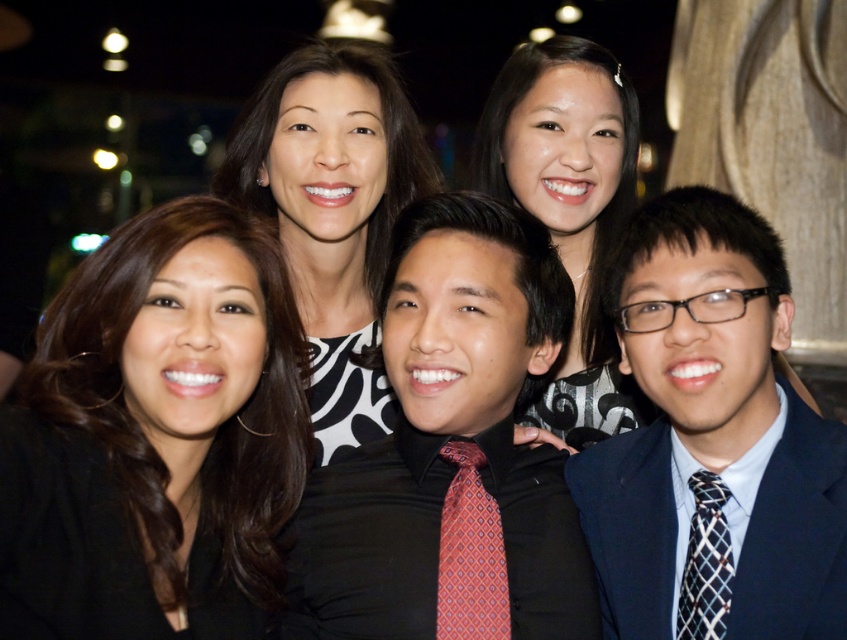
Question: Which object is the closest to the navy blue suit at center?

Choices:
 (A) black matte hair at left
 (B) red silk tie at center

Answer: (B)

Question: Which of these objects is positioned closest to the black checkered tie at right?

Choices:
 (A) matte black dress at center
 (B) red silk tie at center
 (C) black satin shirt at center
 (D) matte black dress at upper center

Answer: (B)

Question: Does navy blue suit at center have a larger size compared to matte black dress at upper center?

Choices:
 (A) yes
 (B) no

Answer: (A)

Question: Does matte black dress at center appear on the right side of matte black dress at upper center?

Choices:
 (A) yes
 (B) no

Answer: (B)

Question: Which point is farther to the camera?

Choices:
 (A) navy blue suit at center
 (B) red silk tie at center
 (C) black checkered tie at right
 (D) black matte hair at left

Answer: (B)

Question: Is navy blue suit at center bigger than matte black dress at upper center?

Choices:
 (A) yes
 (B) no

Answer: (A)